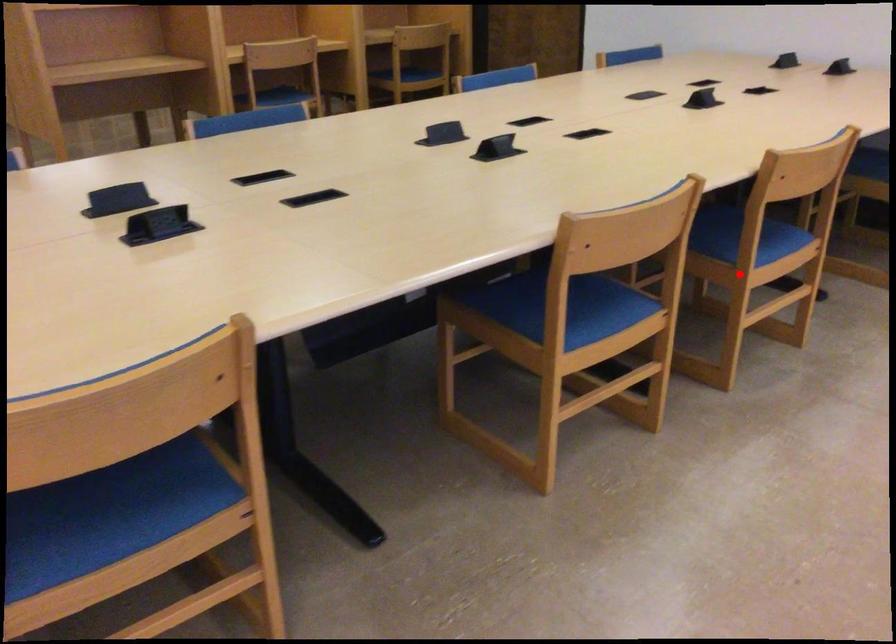
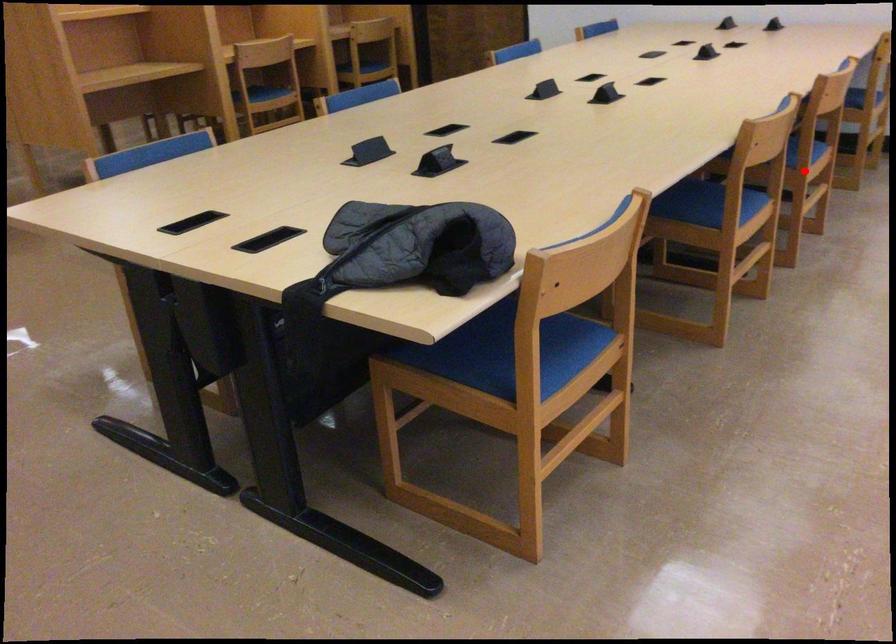
I am providing you with two images of the same scene from different viewpoints. A red point is marked on the first image and another point is marked on the second image. Do the highlighted points in image1 and image2 indicate the same real-world spot?

Yes